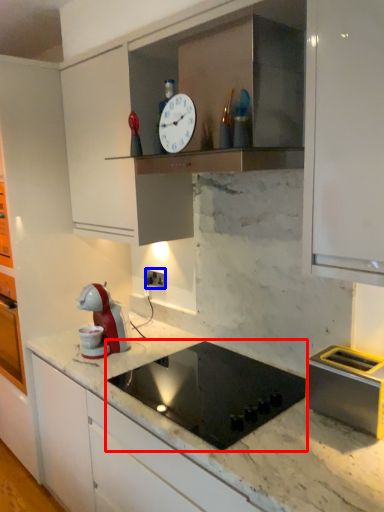
Question: Which of the following is the closest to the observer, gas stove (highlighted by a red box) or electric outlet (highlighted by a blue box)?

Choices:
 (A) gas stove
 (B) electric outlet

Answer: (A)